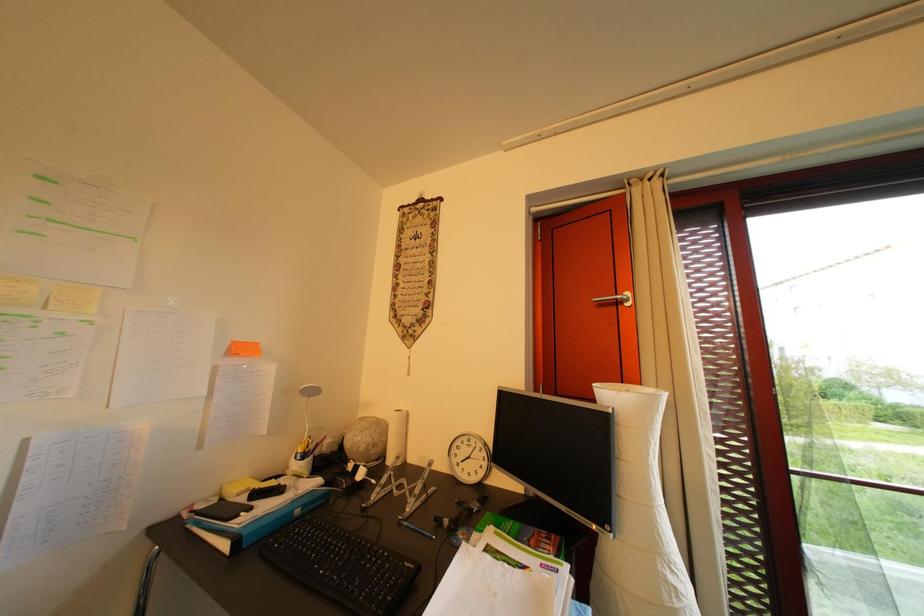
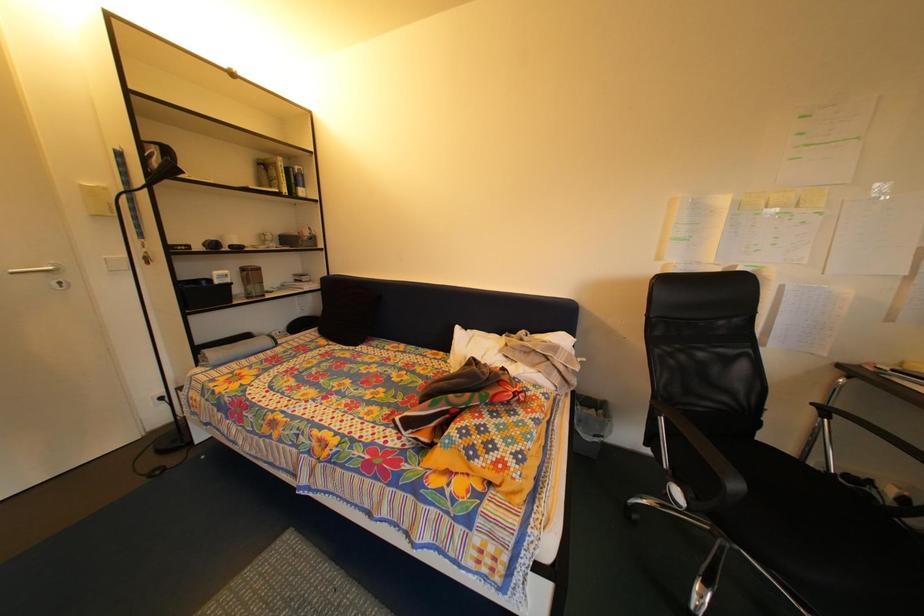
Question: The camera is either moving clockwise (left) or counter-clockwise (right) around the object. The first image is from the beginning of the video and the second image is from the end. Is the camera moving left or right when shooting the video?

Choices:
 (A) Left
 (B) Right

Answer: (B)